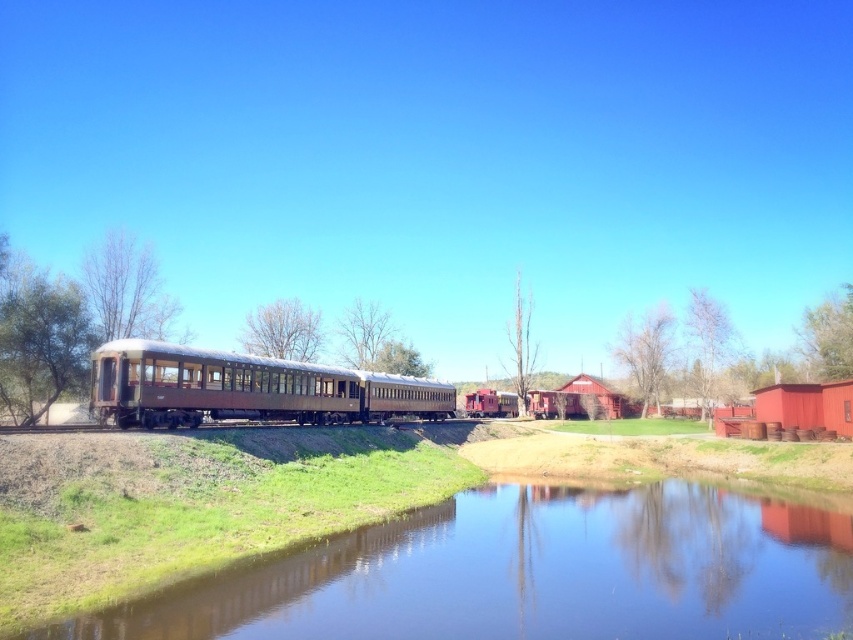
You are a photographer planning to capture the reflection of the rusty metal train car at center in the clear water at center. Based on the scene, can you determine if the entire train car will fit within the width of the water surface for a perfect reflection?

The clear water at center might be wider than rusty metal train car at center, so there is a possibility that the entire train car can fit within the width of the water surface for a perfect reflection.

You are standing on the grassy area near the train and want to cross to the other side of the rusty metal train car at center. The clear water at center is in your path. Which direction should you walk to avoid stepping into the water?

To avoid stepping into the clear water at center, you should walk to the left of the rusty metal train car at center since the clear water at center is located to the right of it.